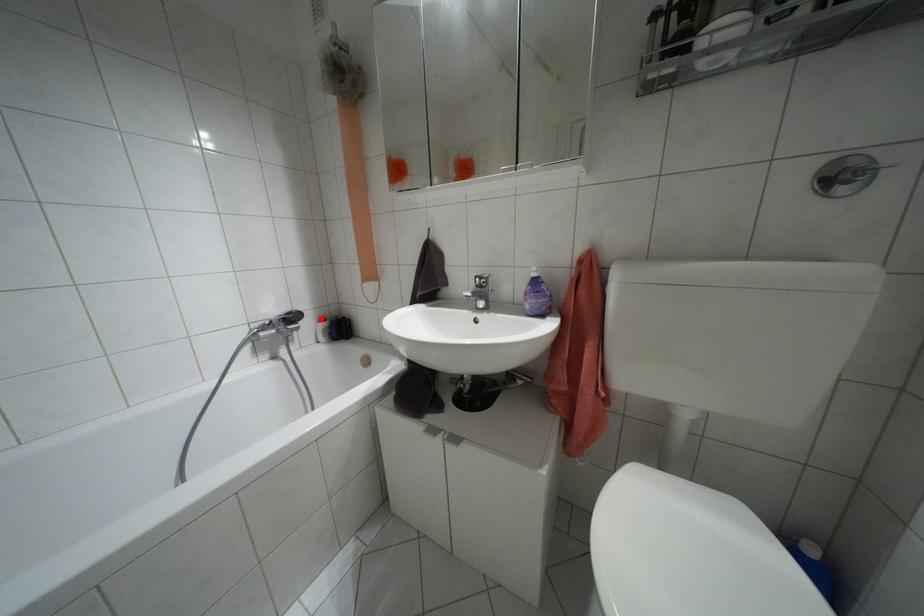
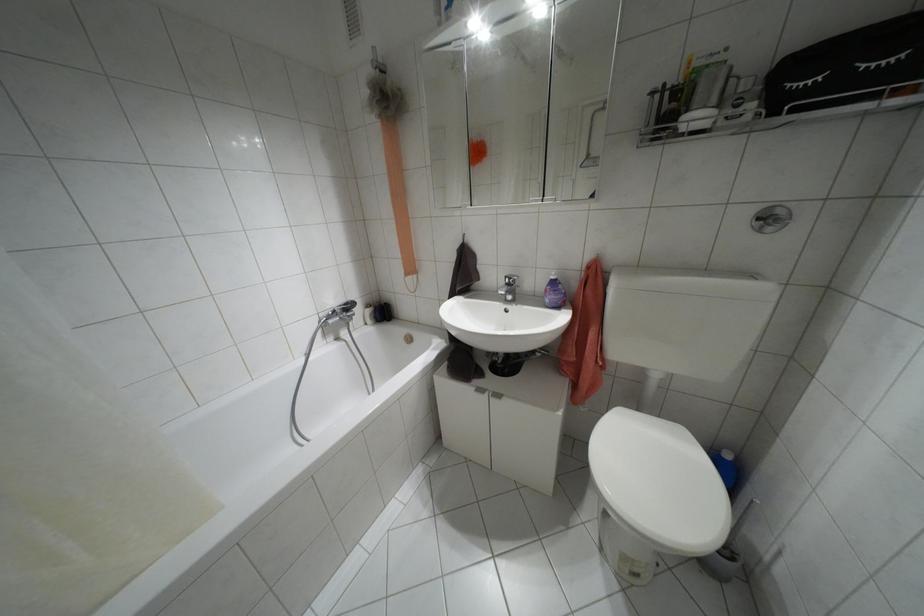
Where in the second image is the point corresponding to the highlighted location from the first image?

(367, 305)